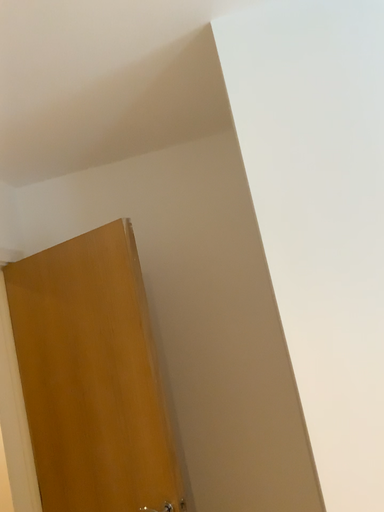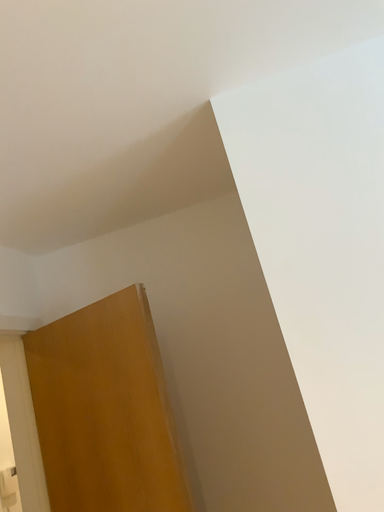
Question: Which way did the camera rotate in the video?

Choices:
 (A) rotated downward
 (B) rotated upward

Answer: (B)